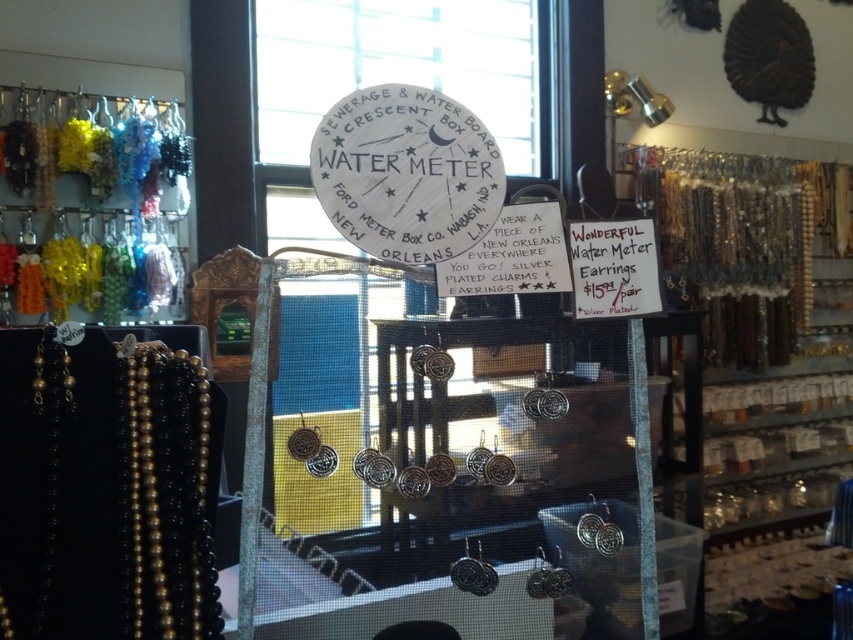
You are a customer in the shop and want to pick up the black beaded necklace at left and the multicolored beads at left. Which one is located lower on the rack?

The black beaded necklace at left is below multicolored beads at left, so the black beaded necklace at left is located lower on the rack.

In the scene shown: You are a customer in the shop and want to pick up both the black beaded necklace at left and the multicolored beads at left. If you can only reach 1.3 meters, will you be able to reach both items?

The black beaded necklace at left and multicolored beads at left are 1.40 meters apart, so you cannot reach both items with a reach of 1.3 meters.

You are a customer in the shop and want to pick up the black beaded necklace at left and the multicolored beads at left. Which one is closer to the center of the store?

The black beaded necklace at left is closer to the center of the store because it is positioned to the right of the multicolored beads at left, meaning it is nearer to the central area.